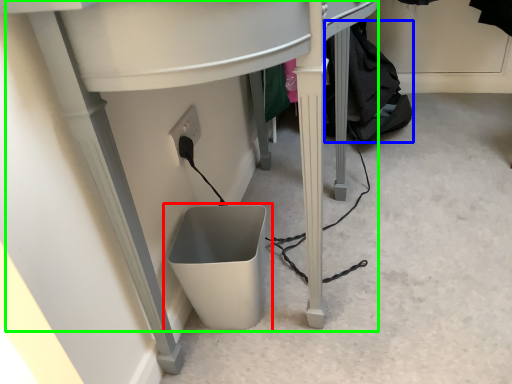
Question: Estimate the real-world distances between objects in this image. Which object is closer to waste container (highlighted by a red box), clothing (highlighted by a blue box) or computer desk (highlighted by a green box)?

Choices:
 (A) clothing
 (B) computer desk

Answer: (B)